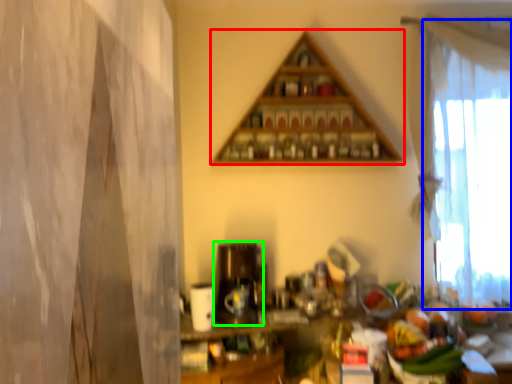
Question: Which object is the farthest from shelf (highlighted by a red box)? Choose among these: curtain (highlighted by a blue box) or appliance (highlighted by a green box).

Choices:
 (A) curtain
 (B) appliance

Answer: (B)